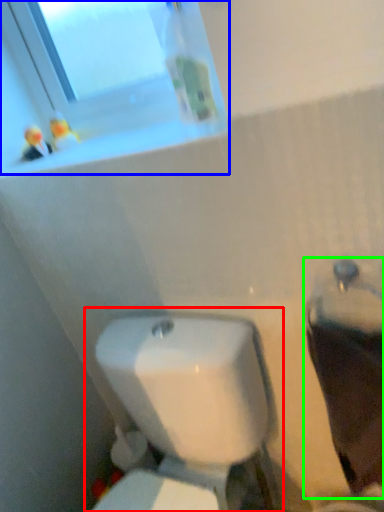
Question: Estimate the real-world distances between objects in this image. Which object is farther from toilet (highlighted by a red box), window (highlighted by a blue box) or porcelain (highlighted by a green box)?

Choices:
 (A) window
 (B) porcelain

Answer: (A)